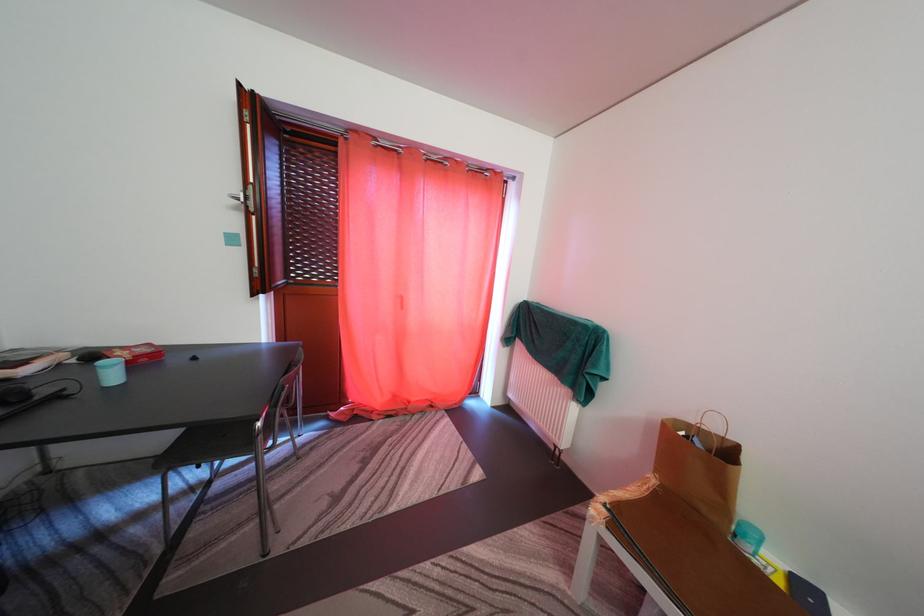
What are the coordinates of `bench sitting surface` in the screenshot? It's located at (685, 554).